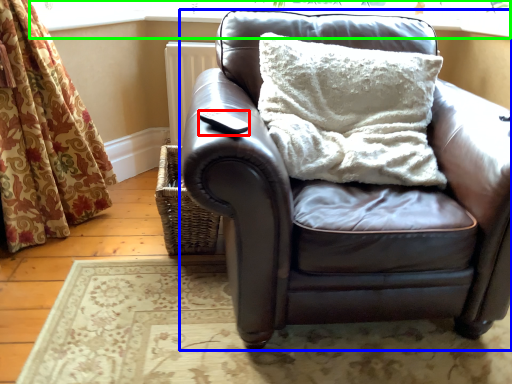
Question: Considering the real-world distances, which object is farthest from pad (highlighted by a red box)? studio couch (highlighted by a blue box) or window frame (highlighted by a green box)?

Choices:
 (A) studio couch
 (B) window frame

Answer: (B)